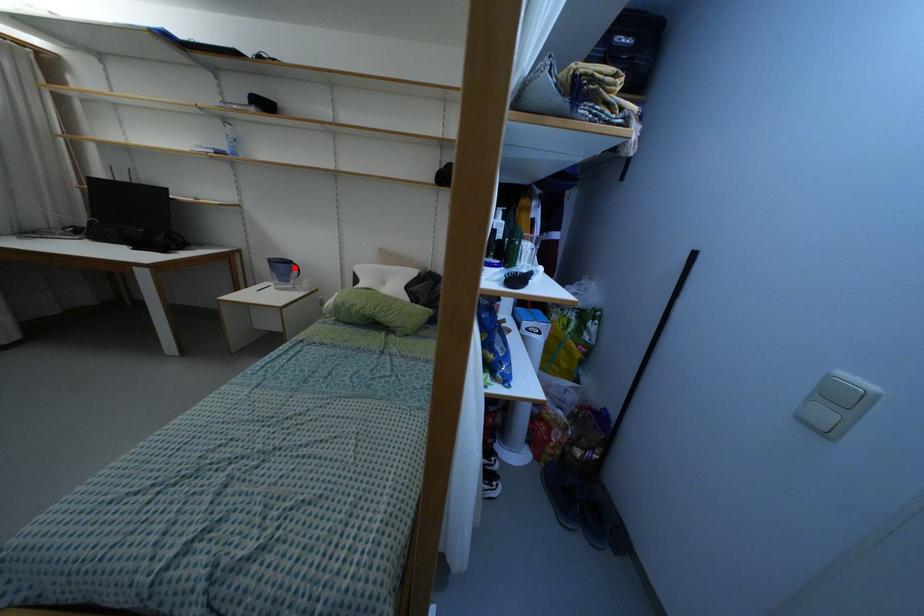
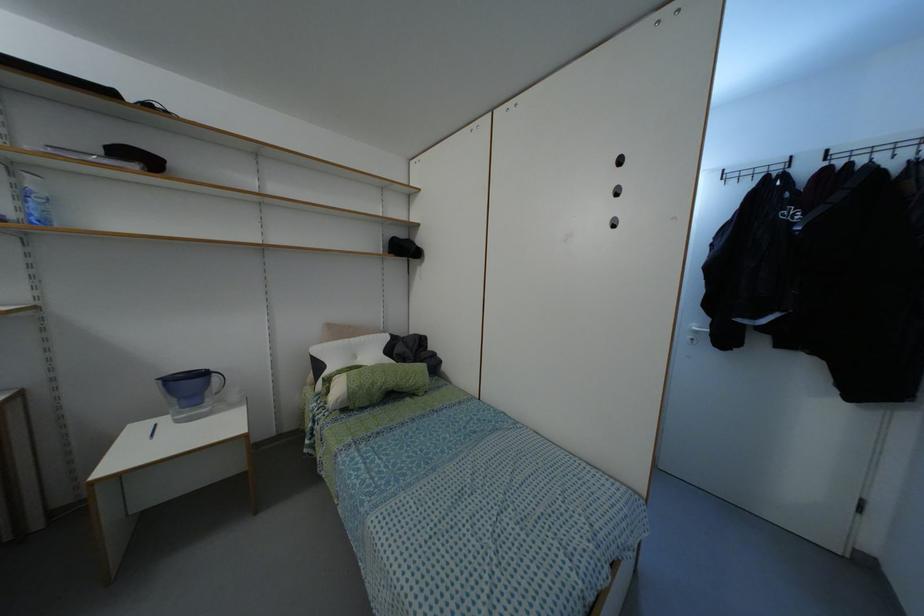
The point at the highlighted location is marked in the first image. Where is the corresponding point in the second image?

(214, 378)